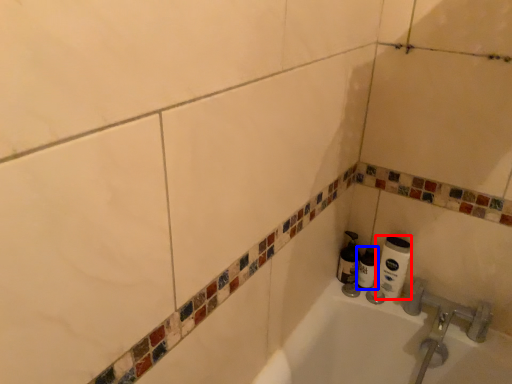
Question: Among these objects, which one is nearest to the camera, toilet paper (highlighted by a red box) or shaving cream (highlighted by a blue box)?

Choices:
 (A) toilet paper
 (B) shaving cream

Answer: (A)